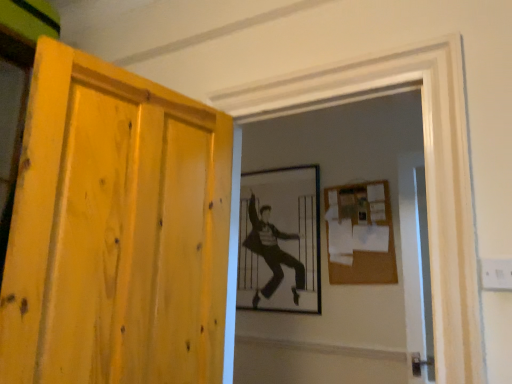
Locate an element on the screen. The image size is (512, 384). burlap-like brown bulletin board at upper right is located at coordinates (360, 234).

The image size is (512, 384). What do you see at coordinates (424, 279) in the screenshot? I see `transparent glass screen door at right` at bounding box center [424, 279].

Identify the location of black and white photograph of a man at center. The image size is (512, 384). (272, 252).

From a real-world perspective, who is located higher, burlap-like brown bulletin board at upper right or transparent glass screen door at right?

In real-world perspective, burlap-like brown bulletin board at upper right is above.

Considering the relative positions of burlap-like brown bulletin board at upper right and transparent glass screen door at right in the image provided, is burlap-like brown bulletin board at upper right to the right of transparent glass screen door at right from the viewer's perspective?

No, burlap-like brown bulletin board at upper right is not to the right of transparent glass screen door at right.

This screenshot has height=384, width=512. I want to click on bulletin board on the left of transparent glass screen door at right, so click(x=360, y=234).

Choose the correct answer: Is burlap-like brown bulletin board at upper right inside transparent glass screen door at right or outside it?

burlap-like brown bulletin board at upper right is spatially situated outside transparent glass screen door at right.

Based on the photo, from a real-world perspective, who is located lower, yellow wood door at left or black and white photograph of a man at center?

yellow wood door at left.

Is there a large distance between yellow wood door at left and black and white photograph of a man at center?

Yes, yellow wood door at left and black and white photograph of a man at center are located far from each other.

Looking at this image, from the image's perspective, between yellow wood door at left and black and white photograph of a man at center, who is located below?

black and white photograph of a man at center is shown below in the image.

From a real-world perspective, is burlap-like brown bulletin board at upper right over yellow wood door at left?

Indeed, from a real-world perspective, burlap-like brown bulletin board at upper right stands above yellow wood door at left.

Considering the positions of objects burlap-like brown bulletin board at upper right and yellow wood door at left in the image provided, who is more to the right, burlap-like brown bulletin board at upper right or yellow wood door at left?

burlap-like brown bulletin board at upper right.

Do you think burlap-like brown bulletin board at upper right is within yellow wood door at left, or outside of it?

burlap-like brown bulletin board at upper right is spatially situated outside yellow wood door at left.

From a real-world perspective, does black and white photograph of a man at center sit lower than transparent glass screen door at right?

No, from a real-world perspective, black and white photograph of a man at center is not under transparent glass screen door at right.

Can you confirm if black and white photograph of a man at center is wider than transparent glass screen door at right?

No, black and white photograph of a man at center is not wider than transparent glass screen door at right.

From the picture: Considering their positions, is black and white photograph of a man at center located in front of or behind transparent glass screen door at right?

Clearly, black and white photograph of a man at center is behind transparent glass screen door at right.

From a real-world perspective, between black and white photograph of a man at center and burlap-like brown bulletin board at upper right, who is vertically higher?

burlap-like brown bulletin board at upper right is physically above.

Do you think black and white photograph of a man at center is within burlap-like brown bulletin board at upper right, or outside of it?

black and white photograph of a man at center is not inside burlap-like brown bulletin board at upper right, it's outside.

Is point (281, 232) behind point (329, 204)?

That is True.

This screenshot has width=512, height=384. I want to click on person that is on the left side of burlap-like brown bulletin board at upper right, so click(272, 252).

Which object is thinner, black and white photograph of a man at center or yellow wood door at left?

With smaller width is black and white photograph of a man at center.

From the picture: Is black and white photograph of a man at center positioned behind yellow wood door at left?

Yes, black and white photograph of a man at center is further from the camera.

Is black and white photograph of a man at center facing towards yellow wood door at left?

Yes, black and white photograph of a man at center faces towards yellow wood door at left.

Find the location of a particular element. person located below the yellow wood door at left (from the image's perspective) is located at coordinates (272, 252).

Find the location of a particular element. The image size is (512, 384). bulletin board in front of the black and white photograph of a man at center is located at coordinates (360, 234).

Considering the sizes of burlap-like brown bulletin board at upper right and black and white photograph of a man at center in the image, is burlap-like brown bulletin board at upper right bigger or smaller than black and white photograph of a man at center?

burlap-like brown bulletin board at upper right is smaller than black and white photograph of a man at center.

Is black and white photograph of a man at center completely or partially inside burlap-like brown bulletin board at upper right?

Definitely not — black and white photograph of a man at center is not inside burlap-like brown bulletin board at upper right.

Can you confirm if burlap-like brown bulletin board at upper right is wider than black and white photograph of a man at center?

No, burlap-like brown bulletin board at upper right is not wider than black and white photograph of a man at center.

Identify the location of bulletin board behind the transparent glass screen door at right. Image resolution: width=512 pixels, height=384 pixels. click(x=360, y=234).

Locate an element on the screen. This screenshot has width=512, height=384. person that appears above the yellow wood door at left (from a real-world perspective) is located at coordinates (272, 252).

Looking at the image, which one is located closer to transparent glass screen door at right, burlap-like brown bulletin board at upper right or black and white photograph of a man at center?

Among the two, burlap-like brown bulletin board at upper right is located nearer to transparent glass screen door at right.

Looking at the image, which one is located closer to yellow wood door at left, burlap-like brown bulletin board at upper right or transparent glass screen door at right?

The object closer to yellow wood door at left is transparent glass screen door at right.

From the image, which object appears to be nearer to yellow wood door at left, transparent glass screen door at right or black and white photograph of a man at center?

transparent glass screen door at right is positioned closer to the anchor yellow wood door at left.

Based on their spatial positions, is yellow wood door at left or black and white photograph of a man at center further from transparent glass screen door at right?

Among the two, yellow wood door at left is located further to transparent glass screen door at right.

When comparing their distances from transparent glass screen door at right, does black and white photograph of a man at center or burlap-like brown bulletin board at upper right seem closer?

burlap-like brown bulletin board at upper right lies closer to transparent glass screen door at right than the other object.

Estimate the real-world distances between objects in this image. Which object is closer to burlap-like brown bulletin board at upper right, yellow wood door at left or black and white photograph of a man at center?

Among the two, black and white photograph of a man at center is located nearer to burlap-like brown bulletin board at upper right.

When comparing their distances from black and white photograph of a man at center, does burlap-like brown bulletin board at upper right or transparent glass screen door at right seem further?

transparent glass screen door at right is further to black and white photograph of a man at center.

Which object lies nearer to the anchor point transparent glass screen door at right, black and white photograph of a man at center or yellow wood door at left?

Based on the image, black and white photograph of a man at center appears to be nearer to transparent glass screen door at right.

Identify the location of bulletin board positioned between yellow wood door at left and black and white photograph of a man at center from near to far. (360, 234).

This screenshot has height=384, width=512. Identify the location of screen door located between yellow wood door at left and black and white photograph of a man at center in the depth direction. coord(424,279).

Where is `bulletin board between black and white photograph of a man at center and transparent glass screen door at right in the horizontal direction`? The image size is (512, 384). bulletin board between black and white photograph of a man at center and transparent glass screen door at right in the horizontal direction is located at coordinates (360, 234).

The height and width of the screenshot is (384, 512). Find the location of `screen door located between yellow wood door at left and burlap-like brown bulletin board at upper right in the depth direction`. screen door located between yellow wood door at left and burlap-like brown bulletin board at upper right in the depth direction is located at coordinates (424, 279).